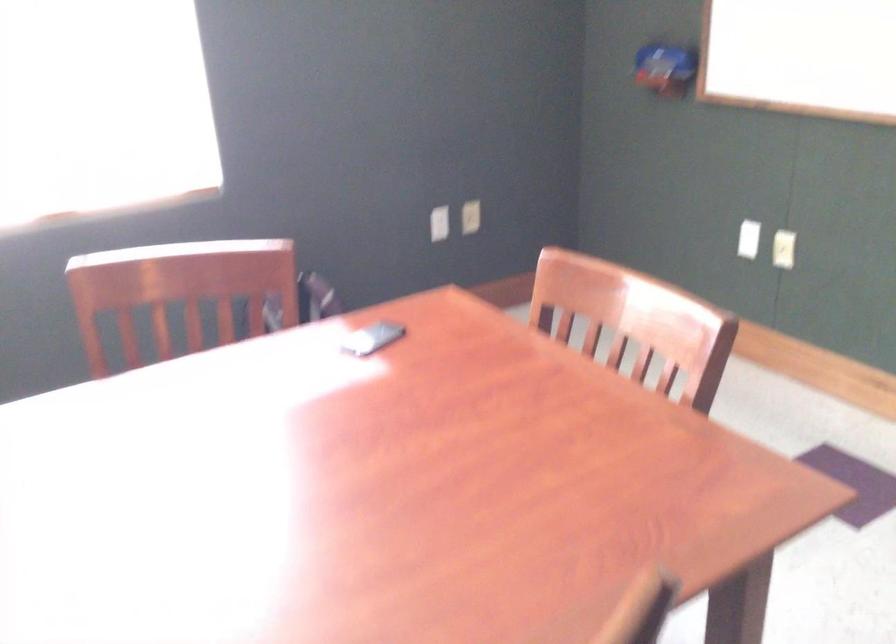
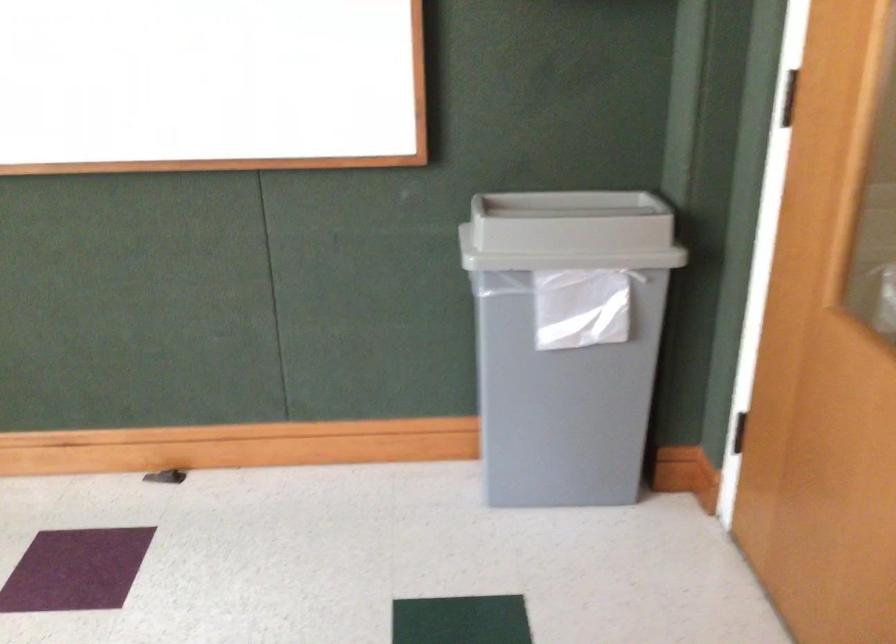
Question: Based on the continuous images, in which direction is the camera rotating? Reply with the corresponding letter.

Choices:
 (A) Left
 (B) Right
 (C) Up
 (D) Down

Answer: (B)